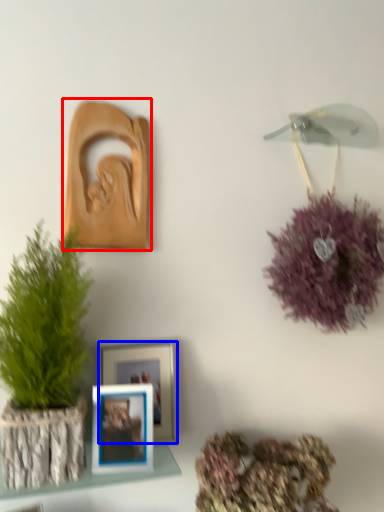
Question: Which object is further to the camera taking this photo, picture frame (highlighted by a red box) or picture frame (highlighted by a blue box)?

Choices:
 (A) picture frame
 (B) picture frame

Answer: (A)